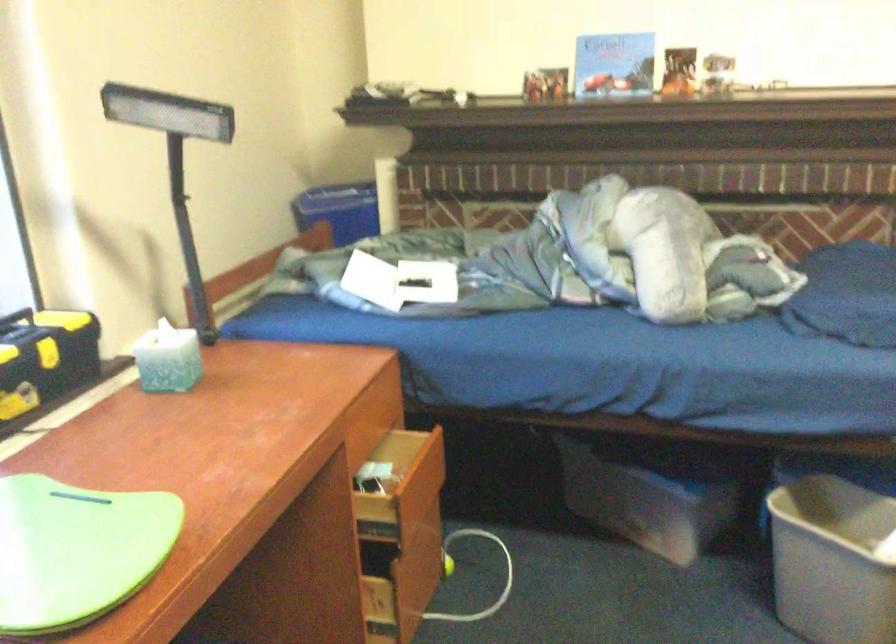
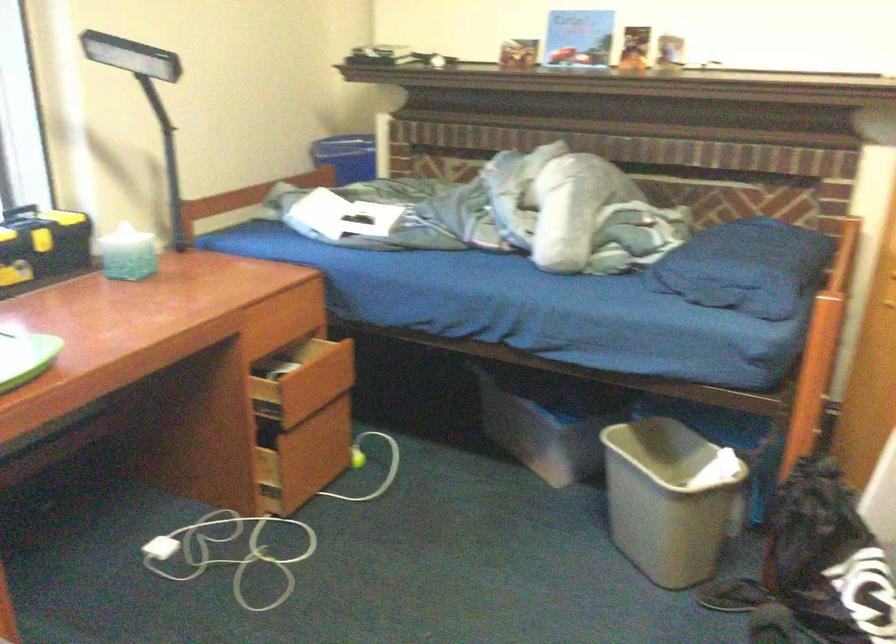
The images are taken continuously from a first-person perspective. In which direction are you moving?

The movement direction of the cameraman is right, backward.